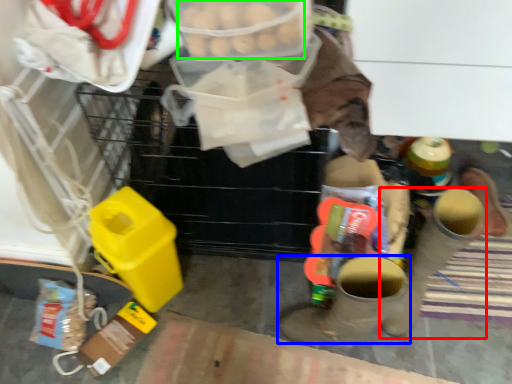
Question: Estimate the real-world distances between objects in this image. Which object is farther from footwear (highlighted by a red box), footwear (highlighted by a blue box) or food (highlighted by a green box)?

Choices:
 (A) footwear
 (B) food

Answer: (B)